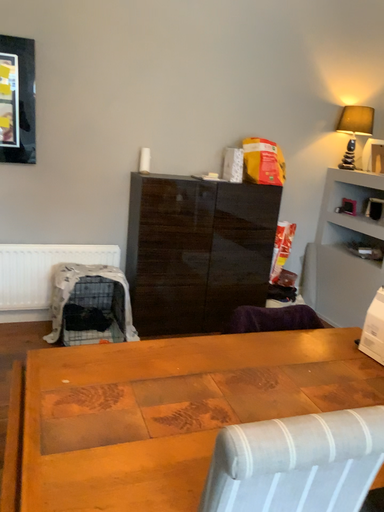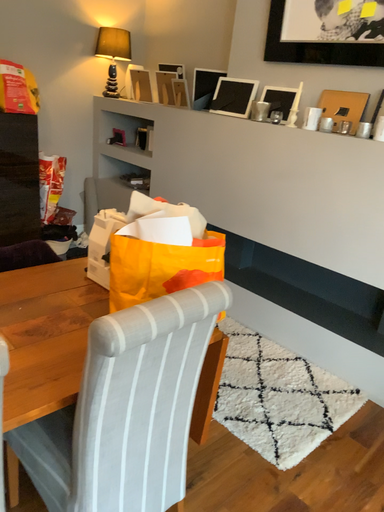
Question: Which way did the camera rotate in the video?

Choices:
 (A) rotated downward
 (B) rotated upward

Answer: (A)